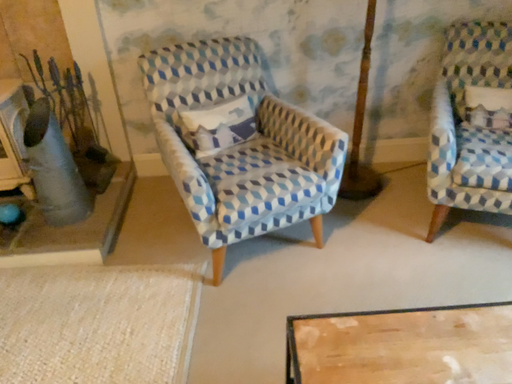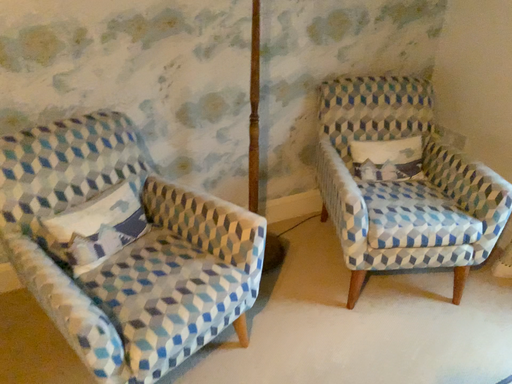
Question: How did the camera likely rotate when shooting the video?

Choices:
 (A) rotated downward
 (B) rotated upward

Answer: (B)